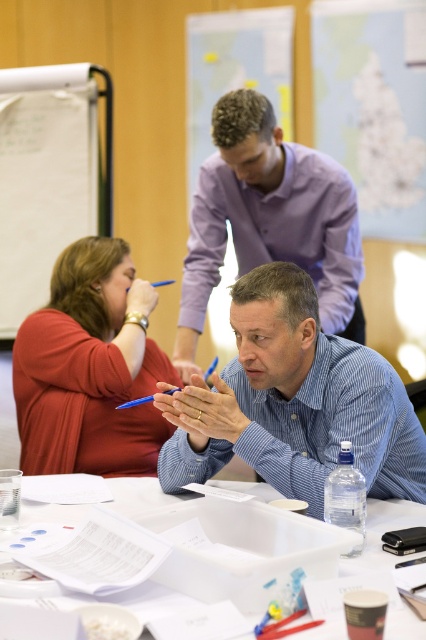
Question: Can you confirm if purple cotton dress shirt at upper center is positioned below matte orange shirt at center?

Choices:
 (A) no
 (B) yes

Answer: (A)

Question: Which is farther from the white paper at upper left?

Choices:
 (A) white plastic tray at center
 (B) blue button-down shirt at center
 (C) matte orange shirt at center

Answer: (A)

Question: Can you confirm if blue button-down shirt at center is bigger than white paper at upper left?

Choices:
 (A) no
 (B) yes

Answer: (B)

Question: Estimate the real-world distances between objects in this image. Which object is farther from the white paper at upper left?

Choices:
 (A) purple cotton dress shirt at upper center
 (B) blue button-down shirt at center
 (C) white plastic tray at center
 (D) matte orange shirt at center

Answer: (C)

Question: Which object is positioned farthest from the white plastic tray at center?

Choices:
 (A) white paper at upper left
 (B) blue button-down shirt at center

Answer: (A)

Question: Is matte orange shirt at center wider than white plastic tray at center?

Choices:
 (A) yes
 (B) no

Answer: (B)